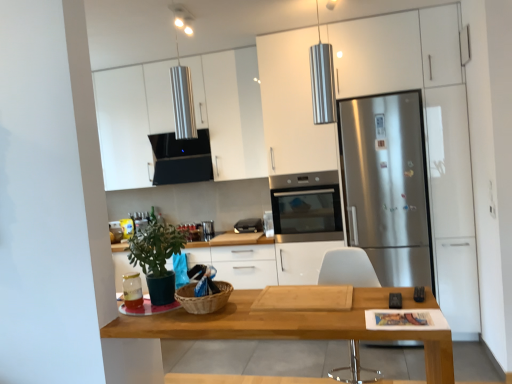
Question: Considering the relative sizes of stainless steel refrigerator at right and matte glass jar at lower left, arranged as the first appliance when ordered from the bottom, in the image provided, is stainless steel refrigerator at right wider than matte glass jar at lower left, arranged as the first appliance when ordered from the bottom,?

Choices:
 (A) yes
 (B) no

Answer: (A)

Question: Can you confirm if stainless steel refrigerator at right is bigger than matte glass jar at lower left, placed as the second appliance when sorted from front to back?

Choices:
 (A) yes
 (B) no

Answer: (A)

Question: Considering the relative sizes of stainless steel refrigerator at right and matte glass jar at lower left, arranged as the first appliance when ordered from the bottom, in the image provided, is stainless steel refrigerator at right smaller than matte glass jar at lower left, arranged as the first appliance when ordered from the bottom,?

Choices:
 (A) no
 (B) yes

Answer: (A)

Question: Is the surface of stainless steel refrigerator at right in direct contact with matte glass jar at lower left, placed as the second appliance when sorted from front to back?

Choices:
 (A) no
 (B) yes

Answer: (A)

Question: Could you tell me if stainless steel refrigerator at right is turned towards matte glass jar at lower left, the first appliance positioned from the left?

Choices:
 (A) no
 (B) yes

Answer: (A)

Question: Is point (166, 322) closer or farther from the camera than point (399, 299)?

Choices:
 (A) closer
 (B) farther

Answer: (A)

Question: Is wooden table at center to the left or to the right of black plastic remote control at lower center, which is counted as the third appliance, starting from the left, in the image?

Choices:
 (A) left
 (B) right

Answer: (A)

Question: Considering the positions of wooden table at center and black plastic remote control at lower center, marked as the 2th appliance in a bottom-to-top arrangement, in the image, is wooden table at center taller or shorter than black plastic remote control at lower center, marked as the 2th appliance in a bottom-to-top arrangement,?

Choices:
 (A) short
 (B) tall

Answer: (B)

Question: Is wooden table at center situated inside black plastic remote control at lower center, acting as the 2th appliance starting from the top, or outside?

Choices:
 (A) outside
 (B) inside

Answer: (A)

Question: From a real-world perspective, is wooden table at center physically located above or below matte glass jar at lower left, placed as the second appliance when sorted from front to back?

Choices:
 (A) above
 (B) below

Answer: (B)

Question: Considering the positions of wooden table at center and matte glass jar at lower left, the 2th appliance viewed from the back, in the image, is wooden table at center bigger or smaller than matte glass jar at lower left, the 2th appliance viewed from the back,?

Choices:
 (A) big
 (B) small

Answer: (A)

Question: In terms of height, does wooden table at center look taller or shorter compared to matte glass jar at lower left, the 2th appliance viewed from the back?

Choices:
 (A) short
 (B) tall

Answer: (B)

Question: Does point (245, 304) appear closer or farther from the camera than point (136, 289)?

Choices:
 (A) closer
 (B) farther

Answer: (A)

Question: Is wooden table at center spatially inside black matte exhaust hood at upper center, or outside of it?

Choices:
 (A) outside
 (B) inside

Answer: (A)

Question: Based on their positions, is wooden table at center located to the left or right of black matte exhaust hood at upper center?

Choices:
 (A) right
 (B) left

Answer: (A)